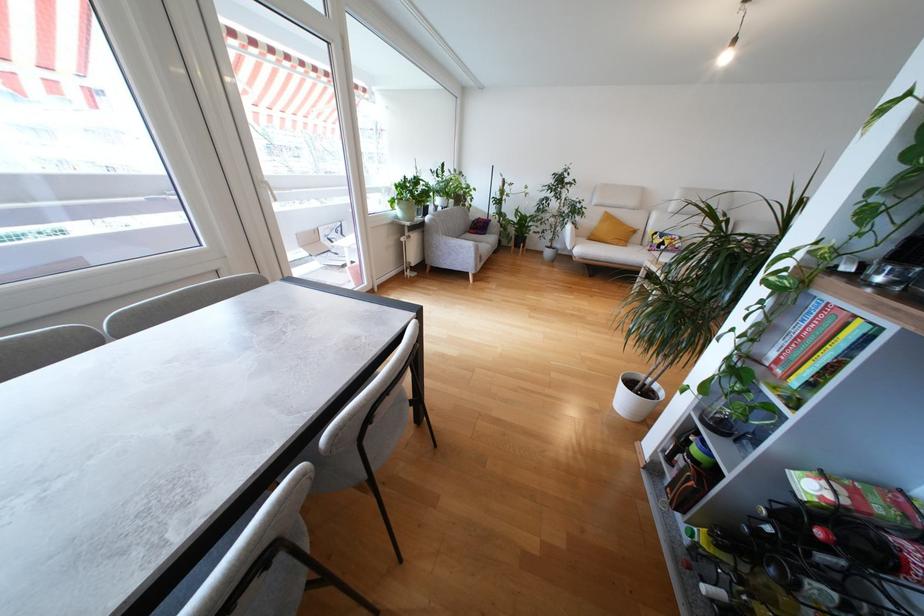
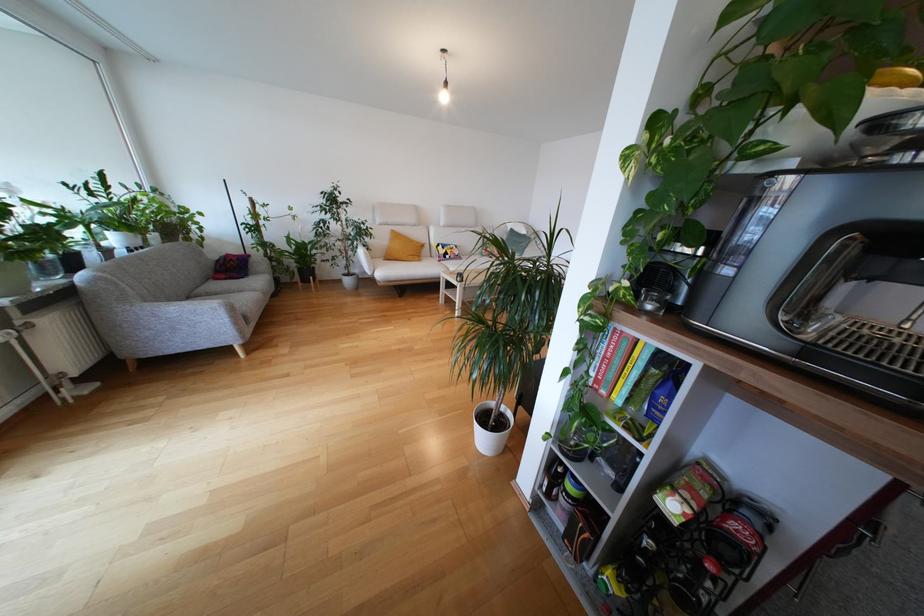
The point at (793, 341) is marked in the first image. Where is the corresponding point in the second image?

(601, 361)